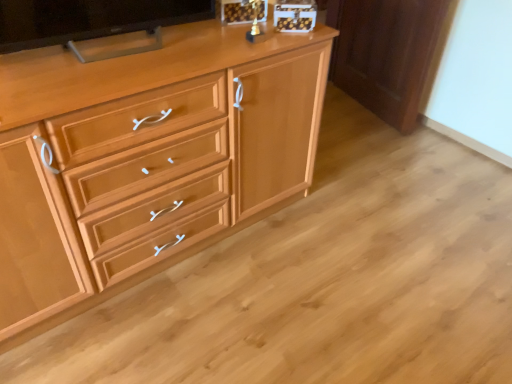
Question: From the image's perspective, does light wood cabinet at center appear higher than matte black tv at upper left?

Choices:
 (A) no
 (B) yes

Answer: (A)

Question: Considering the relative sizes of light wood cabinet at center and matte black tv at upper left in the image provided, is light wood cabinet at center smaller than matte black tv at upper left?

Choices:
 (A) yes
 (B) no

Answer: (B)

Question: Considering the relative sizes of light wood cabinet at center and matte black tv at upper left in the image provided, is light wood cabinet at center shorter than matte black tv at upper left?

Choices:
 (A) yes
 (B) no

Answer: (B)

Question: Is light wood cabinet at center turned away from matte black tv at upper left?

Choices:
 (A) no
 (B) yes

Answer: (A)

Question: Considering the relative sizes of light wood cabinet at center and matte black tv at upper left in the image provided, is light wood cabinet at center bigger than matte black tv at upper left?

Choices:
 (A) no
 (B) yes

Answer: (B)

Question: Looking at the image, does light wood cabinet at center seem bigger or smaller compared to light brown wood cabinet at right?

Choices:
 (A) big
 (B) small

Answer: (A)

Question: From a real-world perspective, relative to light brown wood cabinet at right, is light wood cabinet at center vertically above or below?

Choices:
 (A) above
 (B) below

Answer: (A)

Question: Considering their positions, is light wood cabinet at center located in front of or behind light brown wood cabinet at right?

Choices:
 (A) behind
 (B) front

Answer: (B)

Question: From the image's perspective, is light wood cabinet at center above or below light brown wood cabinet at right?

Choices:
 (A) above
 (B) below

Answer: (B)

Question: From the image's perspective, relative to matte black tv at upper left, is light wood cabinet at center above or below?

Choices:
 (A) above
 (B) below

Answer: (B)

Question: Based on their positions, is light wood cabinet at center located to the left or right of matte black tv at upper left?

Choices:
 (A) right
 (B) left

Answer: (A)

Question: Is light wood cabinet at center spatially inside matte black tv at upper left, or outside of it?

Choices:
 (A) inside
 (B) outside

Answer: (B)

Question: Considering the positions of light wood cabinet at center and matte black tv at upper left in the image, is light wood cabinet at center wider or thinner than matte black tv at upper left?

Choices:
 (A) wide
 (B) thin

Answer: (A)

Question: Which is correct: light brown wood cabinet at right is inside light wood cabinet at center, or outside of it?

Choices:
 (A) inside
 (B) outside

Answer: (B)

Question: From the image's perspective, is light brown wood cabinet at right positioned above or below light wood cabinet at center?

Choices:
 (A) above
 (B) below

Answer: (A)